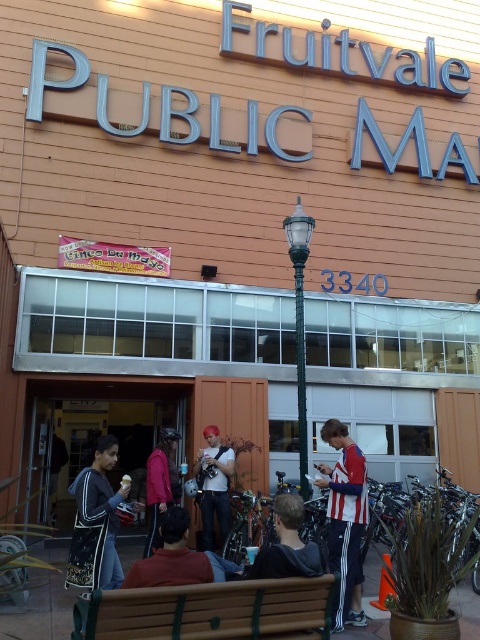
Looking at this image, you are a customer entering the Fruitvale Public Market and need to sit down. You see a brown wooden bench at lower center and a red matte jacket at center. Which object is shorter in height?

The brown wooden bench at lower center has a lesser height compared to the red matte jacket at center, so the brown wooden bench at lower center is shorter.

You are standing at the entrance of the Fruitvale Public Market and notice a green matte lamp post at center and a matte white shirt at center. Which object is taller?

The green matte lamp post at center is much taller than the matte white shirt at center.

Based on the photo, you are standing outside the Fruitvale Public Market and want to take a photo of both the entrance and the banner. You notice two points marked on the ground where you can stand to take the shot. The first point is at coordinates point (340,577) and the second point is at point (211,538). Which point should you choose to ensure both the entrance and the banner are clearly visible in your photo?

You should choose point (340,577) because it is closer to the viewer, allowing for a better view of both the entrance and the banner compared to point (211,538) which is farther away.